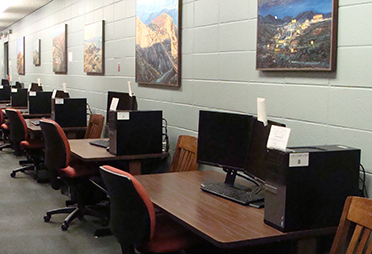
Where is `floor`? This screenshot has height=254, width=372. floor is located at coordinates (38, 205).